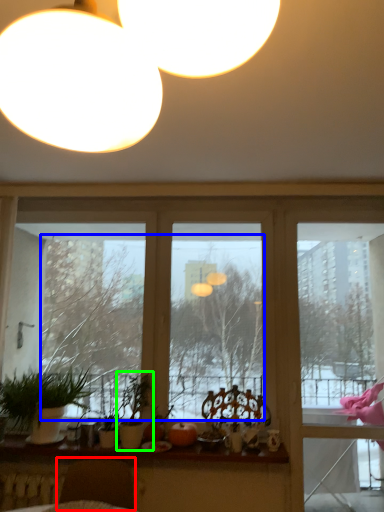
Question: Based on their relative distances, which object is nearer to swivel chair (highlighted by a red box)? Choose from tree (highlighted by a blue box) and houseplant (highlighted by a green box).

Choices:
 (A) tree
 (B) houseplant

Answer: (B)